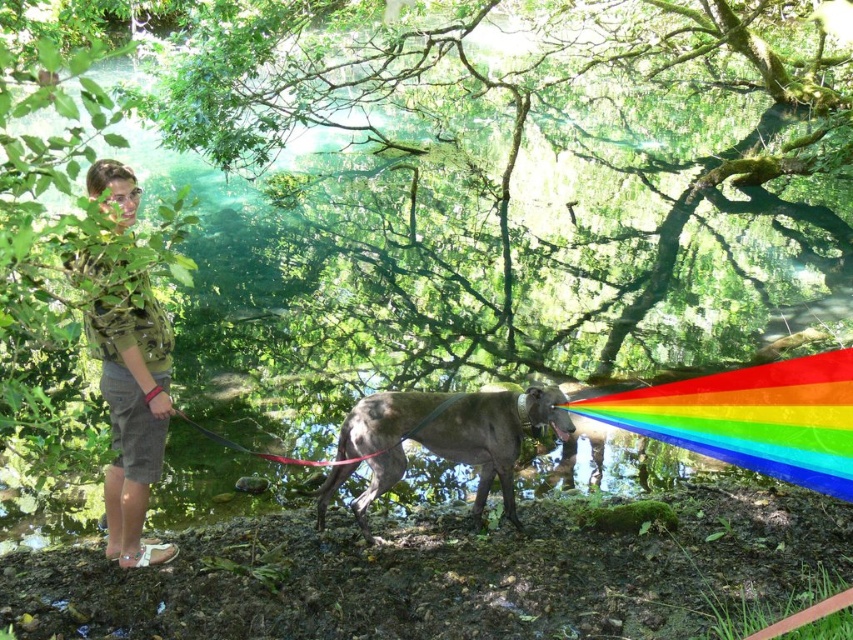
Question: Does rainbow plastic at center appear on the left side of green camouflage shirt at upper left?

Choices:
 (A) yes
 (B) no

Answer: (B)

Question: Which of the following is the closest to the observer?

Choices:
 (A) (828, 380)
 (B) (111, 476)
 (C) (469, 392)

Answer: (B)

Question: Which point is closer to the camera?

Choices:
 (A) (120, 180)
 (B) (397, 417)

Answer: (A)

Question: Is rainbow plastic at center to the right of smooth brown pony at center from the viewer's perspective?

Choices:
 (A) no
 (B) yes

Answer: (B)

Question: Among these points, which one is nearest to the camera?

Choices:
 (A) (782, 438)
 (B) (498, 461)

Answer: (B)

Question: Does rainbow plastic at center have a larger size compared to smooth brown pony at center?

Choices:
 (A) no
 (B) yes

Answer: (B)